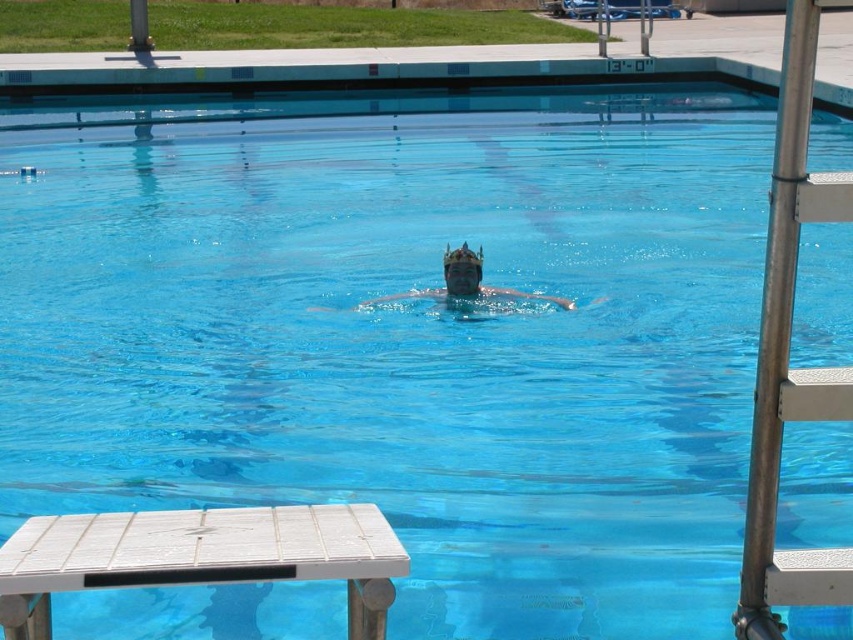
Is white wood picnic table at lower left below transparent plastic crown at center?

Correct, white wood picnic table at lower left is located below transparent plastic crown at center.

The image size is (853, 640). What are the coordinates of `white wood picnic table at lower left` in the screenshot? It's located at (200, 556).

The width and height of the screenshot is (853, 640). I want to click on white wood picnic table at lower left, so click(x=200, y=556).

How much distance is there between white wood picnic table at lower left and transparent blue goggles at center?

white wood picnic table at lower left is 5.09 meters away from transparent blue goggles at center.

Can you confirm if white wood picnic table at lower left is positioned above transparent blue goggles at center?

No.

Is point (109, 513) positioned in front of point (447, 244)?

Yes, it is.

The height and width of the screenshot is (640, 853). In order to click on white wood picnic table at lower left in this screenshot , I will do `click(200, 556)`.

Who is positioned more to the left, transparent plastic crown at center or transparent blue goggles at center?

Positioned to the left is transparent plastic crown at center.

Does point (380, 296) come in front of point (448, 248)?

No, it is behind (448, 248).

Locate an element on the screen. The width and height of the screenshot is (853, 640). transparent plastic crown at center is located at coordinates (466, 282).